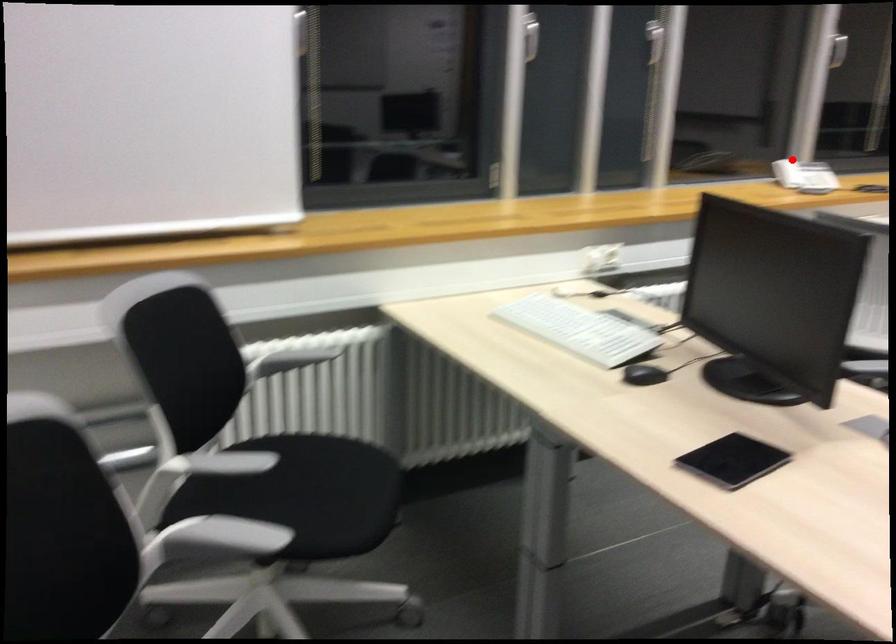
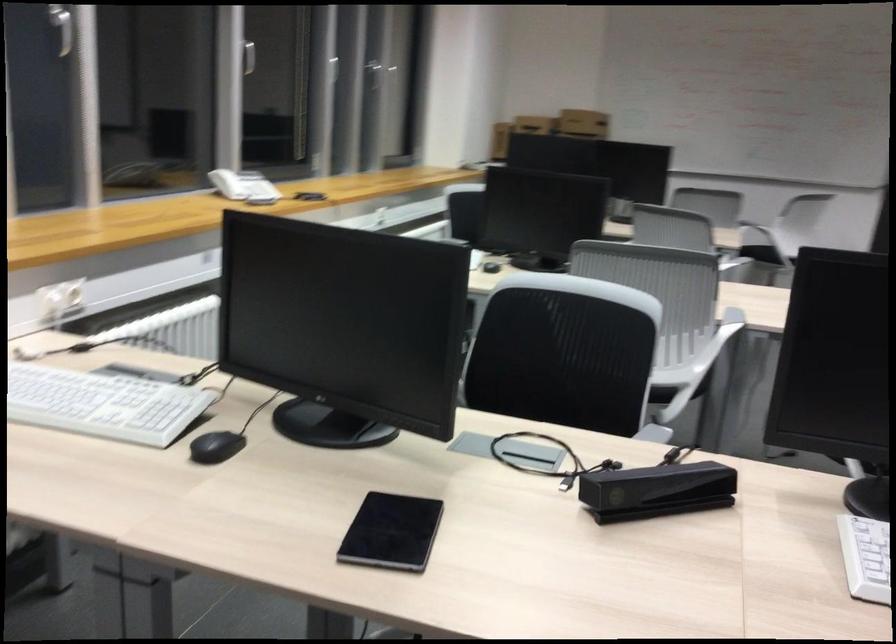
Find the pixel in the second image that matches the highlighted location in the first image.

(227, 184)